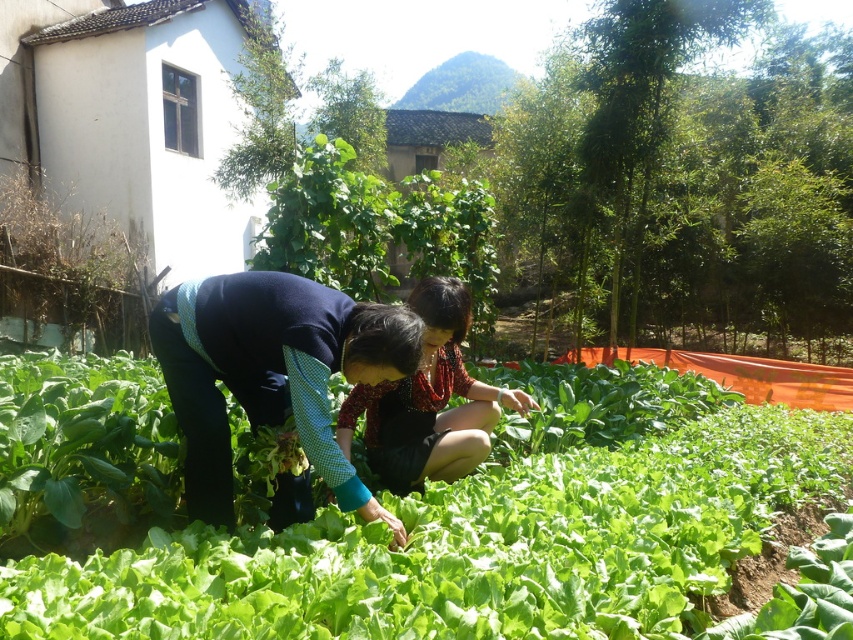
Question: Can you confirm if reddish-brown fabric dress at center is wider than green leafy vegetable at center?

Choices:
 (A) no
 (B) yes

Answer: (A)

Question: Which point is closer to the camera?

Choices:
 (A) tap(338, 467)
 (B) tap(389, 384)

Answer: (A)

Question: Among these points, which one is nearest to the camera?

Choices:
 (A) (461, 323)
 (B) (708, 388)

Answer: (A)

Question: Does dark blue fabric at center appear under reddish-brown fabric dress at center?

Choices:
 (A) no
 (B) yes

Answer: (B)

Question: Does dark blue fabric at center have a smaller size compared to green leafy vegetable at center?

Choices:
 (A) yes
 (B) no

Answer: (A)

Question: Which of the following is the closest to the observer?

Choices:
 (A) green leafy vegetable at center
 (B) dark blue fabric at center
 (C) green leafy vegetables at center

Answer: (C)